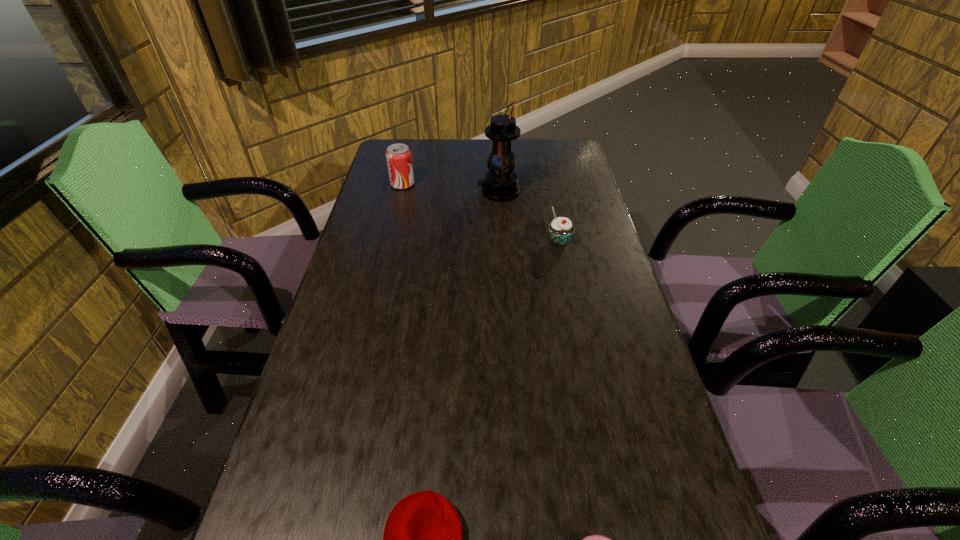
This screenshot has width=960, height=540. In order to click on vacant space located on the front of the cupcake in this screenshot , I will do `click(583, 349)`.

Where is `object that is at the left edge`? The width and height of the screenshot is (960, 540). object that is at the left edge is located at coordinates (399, 160).

Locate an element on the screen. The image size is (960, 540). object that is at the right edge is located at coordinates (561, 229).

Where is `free spot at the left edge of the desktop`? The height and width of the screenshot is (540, 960). free spot at the left edge of the desktop is located at coordinates (378, 228).

This screenshot has height=540, width=960. In order to click on free region at the right edge of the desktop in this screenshot , I will do `click(578, 345)`.

The height and width of the screenshot is (540, 960). In order to click on vacant space at the far right corner of the desktop in this screenshot , I will do `click(570, 166)`.

What are the coordinates of `vacant area between the leftmost object and the lantern` in the screenshot? It's located at 450,188.

Where is `vacant space that's between the lantern and the soda can`? This screenshot has height=540, width=960. vacant space that's between the lantern and the soda can is located at coordinates point(450,188).

Where is `object that is the third closest to the third object from left to right`? object that is the third closest to the third object from left to right is located at coordinates (422, 539).

Locate an element on the screen. This screenshot has width=960, height=540. the second closest object to the shortest object is located at coordinates (561, 229).